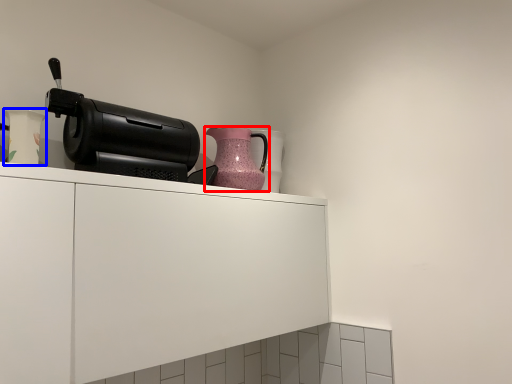
Question: Which of the following is the farthest to the observer, jug (highlighted by a red box) or vase (highlighted by a blue box)?

Choices:
 (A) jug
 (B) vase

Answer: (A)